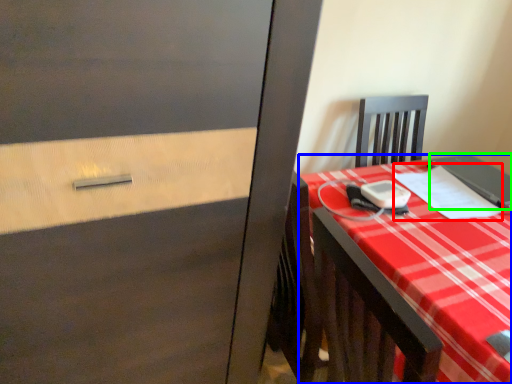
Question: Which object is positioned farthest from notebook (highlighted by a red box)? Select from desk (highlighted by a blue box) and notebook (highlighted by a green box).

Choices:
 (A) desk
 (B) notebook

Answer: (A)